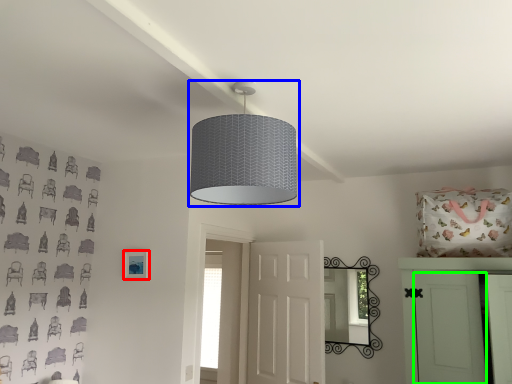
Question: Which object is positioned closest to picture frame (highlighted by a red box)? Select from lamp (highlighted by a blue box) and door (highlighted by a green box).

Choices:
 (A) lamp
 (B) door

Answer: (A)